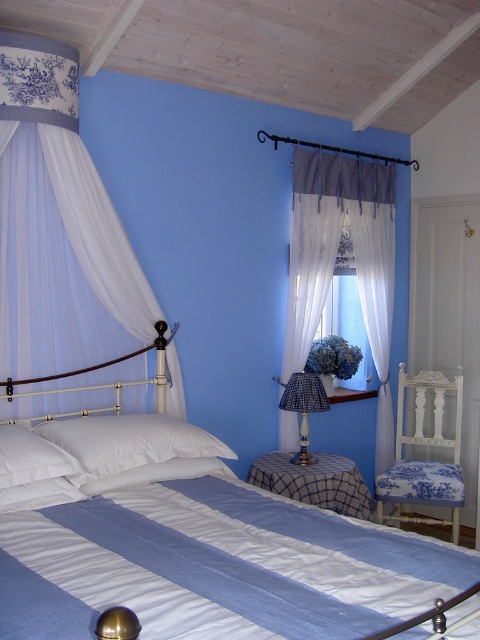
Question: Which point appears farthest from the camera in this image?

Choices:
 (A) (81, 438)
 (B) (300, 380)
 (C) (356, 278)

Answer: (C)

Question: Which of the following is the closest to the observer?

Choices:
 (A) white cotton bed at center
 (B) blue plaid fabric lampshade at center
 (C) blue fabric at center

Answer: (A)

Question: Among these points, which one is farthest from the camera?

Choices:
 (A) (296, 384)
 (B) (36, 454)

Answer: (A)

Question: Is white sheer curtain at upper left positioned in front of white sheer curtain at center?

Choices:
 (A) no
 (B) yes

Answer: (B)

Question: Can you confirm if blue fabric at center is positioned to the right of blue plaid fabric lampshade at center?

Choices:
 (A) no
 (B) yes

Answer: (B)

Question: Does white cotton bed at center have a smaller size compared to blue fabric at center?

Choices:
 (A) no
 (B) yes

Answer: (A)